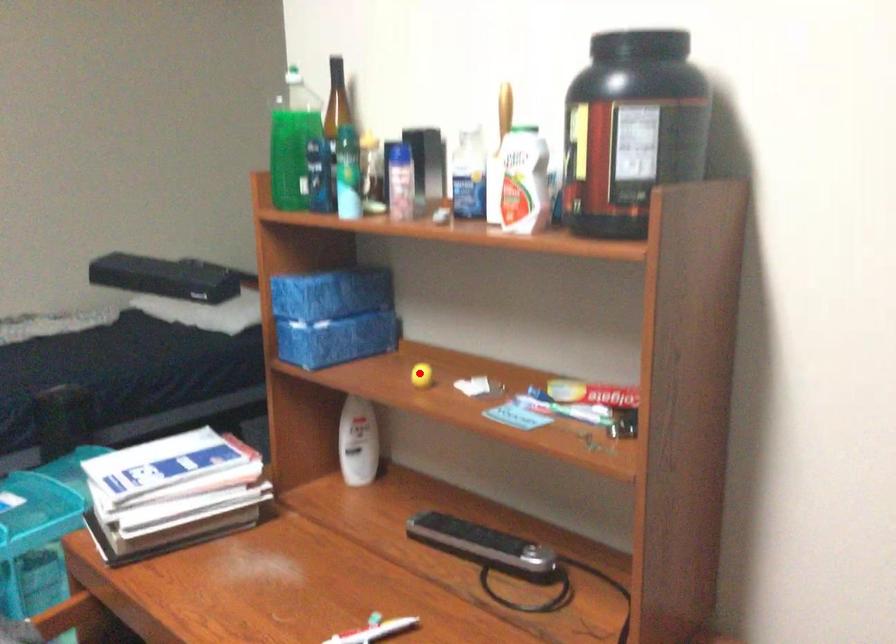
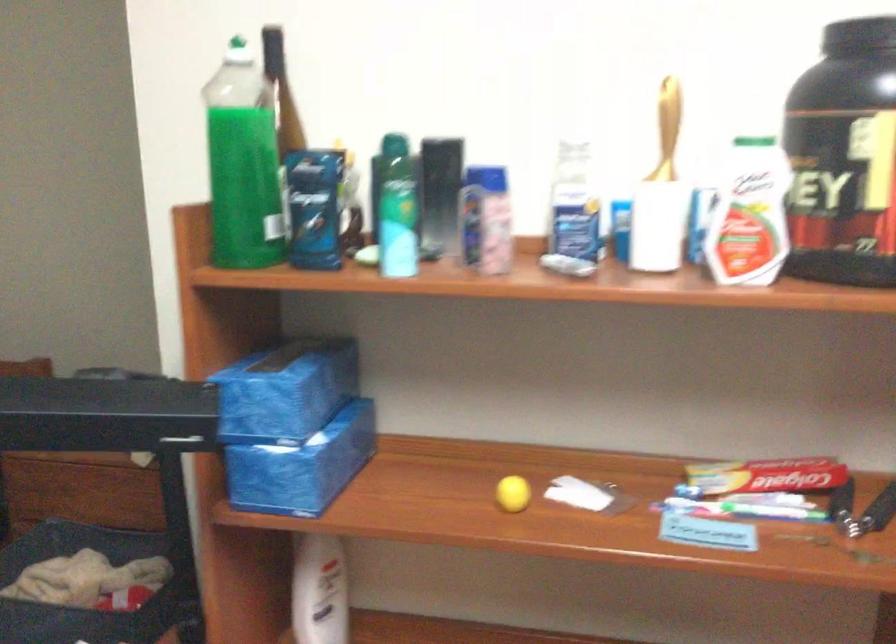
Question: I am providing you with two images of the same scene from different viewpoints. Image1 has a red point marked. In image2, the corresponding 3D location appears at what relative position? Reply with the corresponding letter.

Choices:
 (A) Closer
 (B) Farther

Answer: (A)